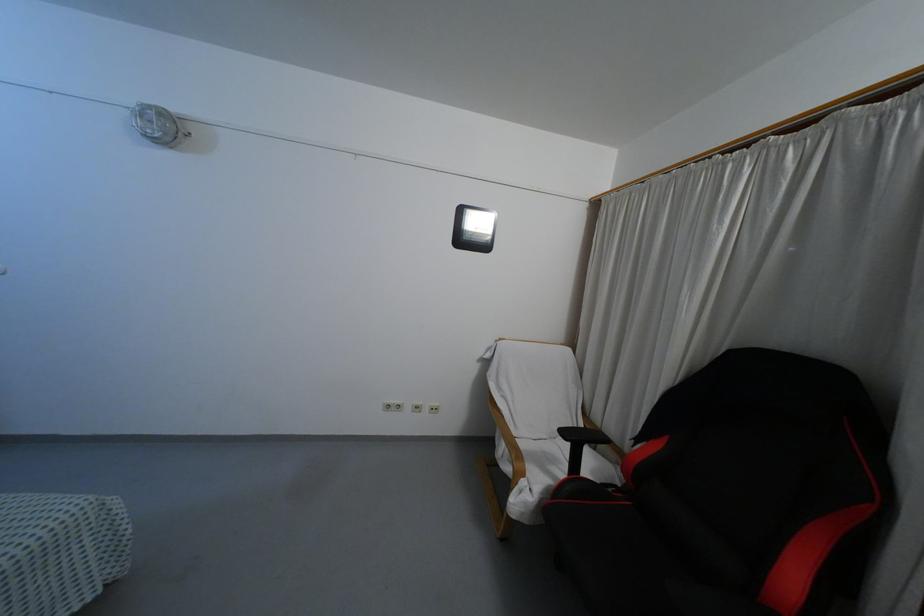
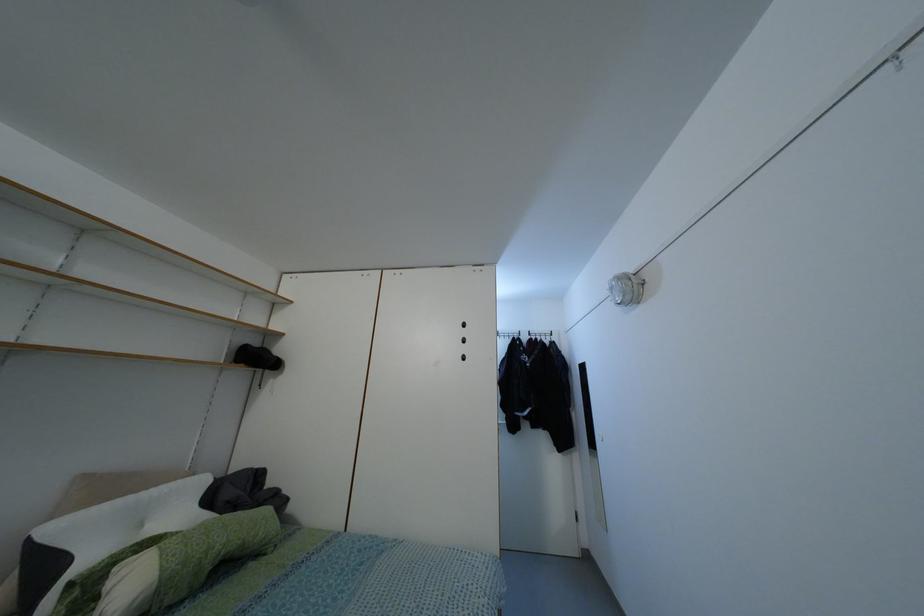
From the picture: Based on the continuous images, in which direction is the camera rotating?

The rotation direction of the camera is left-up.